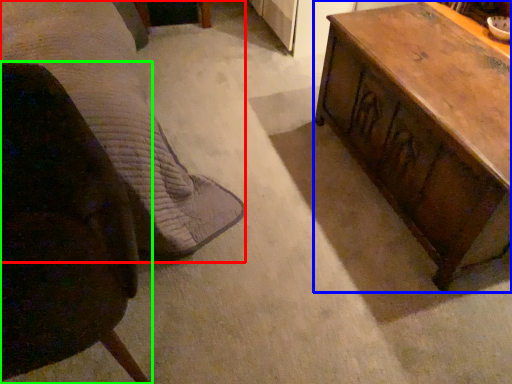
Question: Which object is the closest to the bed (highlighted by a red box)? Choose among these: table (highlighted by a blue box) or chair (highlighted by a green box).

Choices:
 (A) table
 (B) chair

Answer: (B)